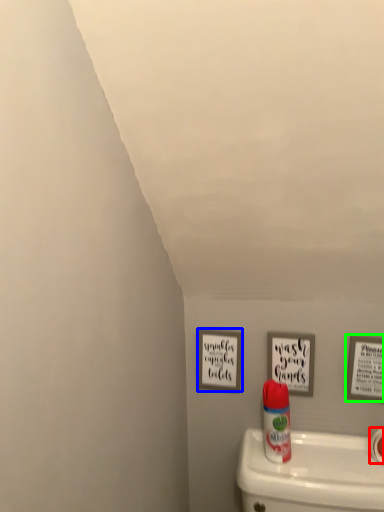
Question: Considering the real-world distances, which object is closest to toilet paper (highlighted by a red box)? picture frame (highlighted by a blue box) or picture frame (highlighted by a green box).

Choices:
 (A) picture frame
 (B) picture frame

Answer: (B)